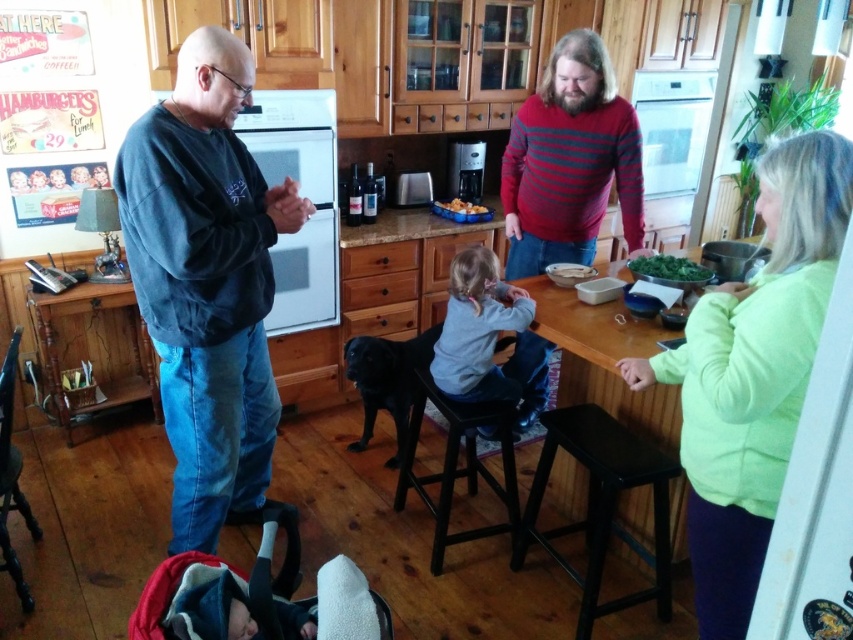
Question: In this image, where is dark blue sweatshirt at left located relative to green fleece jacket at upper right?

Choices:
 (A) left
 (B) right

Answer: (A)

Question: Estimate the real-world distances between objects in this image. Which object is farther from the gray fleece jacket at center?

Choices:
 (A) black plastic stool at lower center
 (B) dark blue sweatshirt at left
 (C) green fleece jacket at upper right
 (D) black smooth dog at center

Answer: (C)

Question: Considering the real-world distances, which object is farthest from the green fleece jacket at upper right?

Choices:
 (A) golden brown crispy chicken at center
 (B) black smooth dog at center

Answer: (A)

Question: Observing the image, what is the correct spatial positioning of dark blue sweatshirt at left in reference to wooden table at center?

Choices:
 (A) right
 (B) left

Answer: (B)

Question: Which object is positioned closest to the wooden table at center?

Choices:
 (A) black wood stool at center
 (B) gray fleece jacket at center

Answer: (B)

Question: Does striped sweater at center appear over red fabric baby carriage at lower left?

Choices:
 (A) no
 (B) yes

Answer: (B)